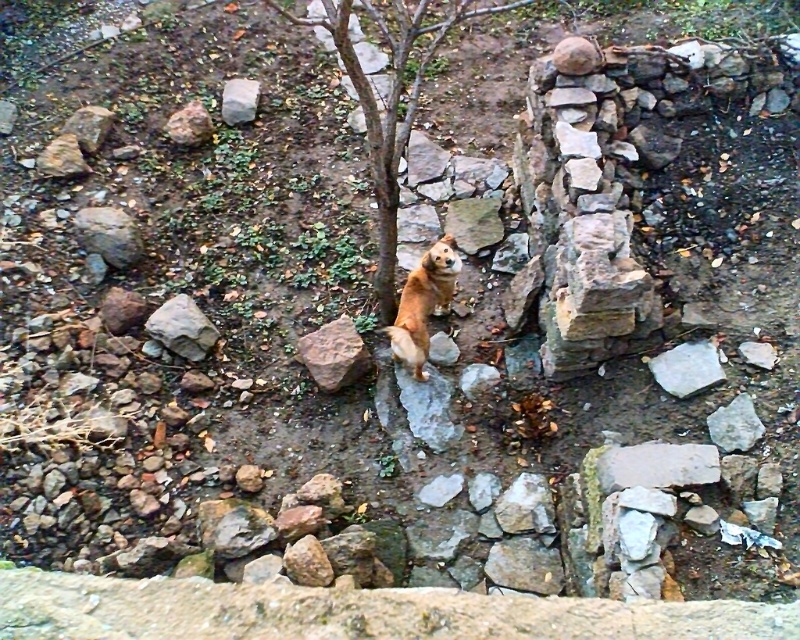
Question: Estimate the real-world distances between objects in this image. Which object is farther from the brown rough rock at center?

Choices:
 (A) gray rough rock at center-left
 (B) gray rough rock at left
 (C) brown bark tree at center

Answer: (B)

Question: Does brown bark tree at center have a lesser width compared to gray rough rock at left?

Choices:
 (A) yes
 (B) no

Answer: (B)

Question: Which point is farther from the camera taking this photo?

Choices:
 (A) (237, 109)
 (B) (460, 262)

Answer: (A)

Question: Which is nearer to the brown bark tree at center?

Choices:
 (A) white smooth rock at lower right
 (B) golden fur dog at center

Answer: (B)

Question: Is the position of golden fur dog at center more distant than that of brown rough rock at center?

Choices:
 (A) no
 (B) yes

Answer: (A)

Question: Does gray rough rock at left have a greater width compared to white smooth rock at lower right?

Choices:
 (A) yes
 (B) no

Answer: (A)